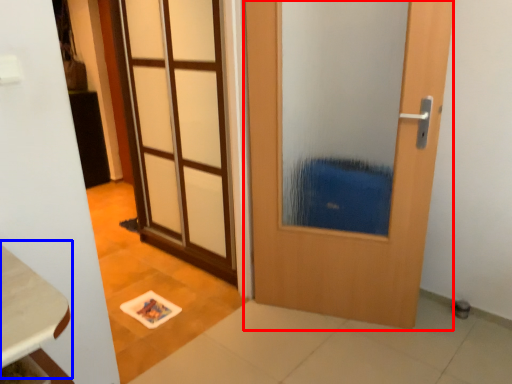
Question: Which object is closer to the camera taking this photo, door (highlighted by a red box) or table (highlighted by a blue box)?

Choices:
 (A) door
 (B) table

Answer: (B)